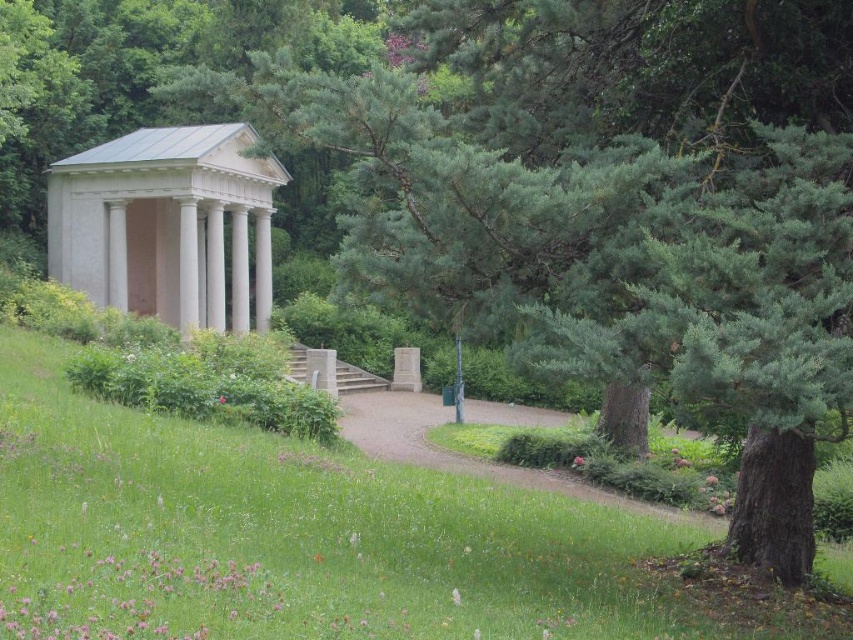
Between green grassy at lower left and gravel path at center, which one is positioned lower?

gravel path at center is below.

Is green grassy at lower left shorter than gravel path at center?

No, green grassy at lower left is not shorter than gravel path at center.

Image resolution: width=853 pixels, height=640 pixels. In order to click on green grassy at lower left in this screenshot , I will do `click(309, 538)`.

Is white smooth gazebo at center smaller than gravel path at center?

No.

Between white smooth gazebo at center and gravel path at center, which one appears on the left side from the viewer's perspective?

white smooth gazebo at center

Locate an element on the screen. This screenshot has height=640, width=853. white smooth gazebo at center is located at coordinates (166, 225).

This screenshot has width=853, height=640. I want to click on white smooth gazebo at center, so click(166, 225).

This screenshot has height=640, width=853. What do you see at coordinates (309, 538) in the screenshot? I see `green grassy at lower left` at bounding box center [309, 538].

Between green grassy at lower left and white smooth gazebo at center, which one is positioned lower?

green grassy at lower left is below.

The height and width of the screenshot is (640, 853). Find the location of `green grassy at lower left`. green grassy at lower left is located at coordinates (309, 538).